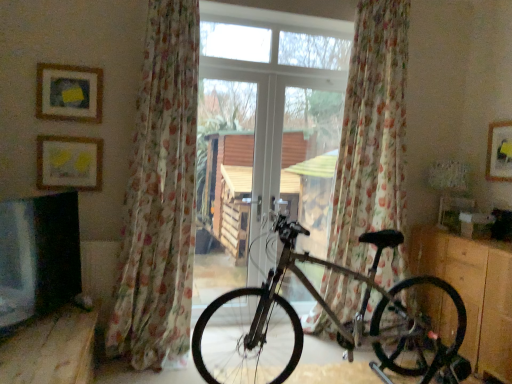
Question: Does wooden dresser at lower right have a lesser height compared to matte gold picture frame at upper left, which is counted as the second picture frame, starting from the left?

Choices:
 (A) no
 (B) yes

Answer: (A)

Question: From a real-world perspective, is wooden dresser at lower right located beneath matte gold picture frame at upper left, which is counted as the second picture frame, starting from the left?

Choices:
 (A) no
 (B) yes

Answer: (B)

Question: Does wooden dresser at lower right have a lesser width compared to matte gold picture frame at upper left, which ranks as the 1th picture frame in front-to-back order?

Choices:
 (A) yes
 (B) no

Answer: (B)

Question: Considering the relative sizes of wooden dresser at lower right and matte gold picture frame at upper left, positioned as the 3th picture frame in back-to-front order, in the image provided, is wooden dresser at lower right wider than matte gold picture frame at upper left, positioned as the 3th picture frame in back-to-front order,?

Choices:
 (A) no
 (B) yes

Answer: (B)

Question: Considering the relative positions of wooden dresser at lower right and matte gold picture frame at upper left, which is counted as the second picture frame, starting from the left, in the image provided, is wooden dresser at lower right to the left of matte gold picture frame at upper left, which is counted as the second picture frame, starting from the left, from the viewer's perspective?

Choices:
 (A) no
 (B) yes

Answer: (A)

Question: Is matte yellow picture frame at upper left, marked as the 2th picture frame in a front-to-back arrangement, inside the boundaries of wooden dresser at lower right, or outside?

Choices:
 (A) inside
 (B) outside

Answer: (B)

Question: Considering the relative positions of matte yellow picture frame at upper left, marked as the third picture frame in a right-to-left arrangement, and wooden dresser at lower right in the image provided, is matte yellow picture frame at upper left, marked as the third picture frame in a right-to-left arrangement, to the left or to the right of wooden dresser at lower right?

Choices:
 (A) left
 (B) right

Answer: (A)

Question: Is matte yellow picture frame at upper left, marked as the 2th picture frame in a front-to-back arrangement, wider or thinner than wooden dresser at lower right?

Choices:
 (A) thin
 (B) wide

Answer: (A)

Question: In terms of size, does matte yellow picture frame at upper left, which is the first picture frame from left to right, appear bigger or smaller than wooden dresser at lower right?

Choices:
 (A) small
 (B) big

Answer: (A)

Question: Considering their positions, is floral sheer curtain at center, which is counted as the 2th curtain, starting from the left, located in front of or behind floral sheer curtain at left, which is counted as the first curtain, starting from the left?

Choices:
 (A) front
 (B) behind

Answer: (B)

Question: Is floral sheer curtain at center, which is counted as the 2th curtain, starting from the left, spatially inside floral sheer curtain at left, which is counted as the first curtain, starting from the left, or outside of it?

Choices:
 (A) inside
 (B) outside

Answer: (B)

Question: Would you say floral sheer curtain at center, the 1th curtain positioned from the right, is to the left or to the right of floral sheer curtain at left, which is counted as the first curtain, starting from the left, in the picture?

Choices:
 (A) right
 (B) left

Answer: (A)

Question: Considering the positions of floral sheer curtain at center, the 1th curtain positioned from the right, and floral sheer curtain at left, which is counted as the first curtain, starting from the left, in the image, is floral sheer curtain at center, the 1th curtain positioned from the right, bigger or smaller than floral sheer curtain at left, which is counted as the first curtain, starting from the left,?

Choices:
 (A) small
 (B) big

Answer: (B)

Question: From a real-world perspective, is matte yellow picture frame at upper left, marked as the third picture frame in a right-to-left arrangement, physically located above or below matte yellow picture frame at upper right, marked as the third picture frame in a left-to-right arrangement?

Choices:
 (A) above
 (B) below

Answer: (B)

Question: Does point (42, 150) appear closer or farther from the camera than point (490, 147)?

Choices:
 (A) closer
 (B) farther

Answer: (A)